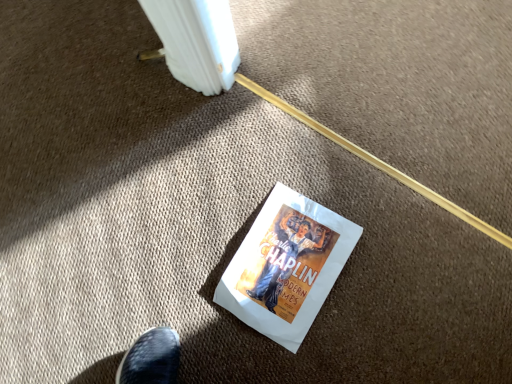
You are a GUI agent. You are given a task and a screenshot of the screen. Output one action in this format:
    pyautogui.click(x=<x>, y=<y>)
    Task: Click on the vacant region under white paper at center (from a real-world perspective)
    The height and width of the screenshot is (384, 512).
    Given the screenshot: What is the action you would take?
    pyautogui.click(x=292, y=262)